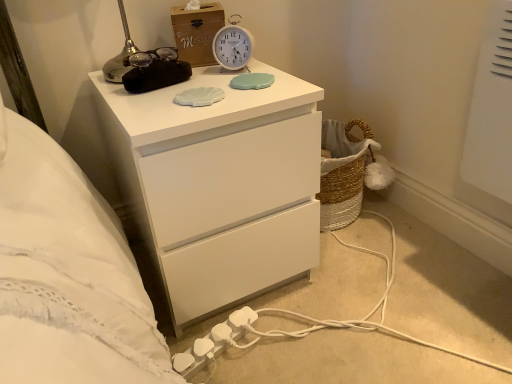
Question: Does white plastic extension cord at lower center lie in front of woodenmaterial/texturebox at upper center?

Choices:
 (A) no
 (B) yes

Answer: (B)

Question: Is white plastic extension cord at lower center next to woodenmaterial/texturebox at upper center?

Choices:
 (A) no
 (B) yes

Answer: (A)

Question: From a real-world perspective, is white plastic extension cord at lower center on woodenmaterial/texturebox at upper center?

Choices:
 (A) yes
 (B) no

Answer: (B)

Question: Considering the relative positions of white plastic extension cord at lower center and woodenmaterial/texturebox at upper center in the image provided, is white plastic extension cord at lower center to the right of woodenmaterial/texturebox at upper center from the viewer's perspective?

Choices:
 (A) no
 (B) yes

Answer: (B)

Question: Is white plastic extension cord at lower center wider than woodenmaterial/texturebox at upper center?

Choices:
 (A) yes
 (B) no

Answer: (B)

Question: From the image's perspective, would you say white plastic extension cord at lower center is shown under woodenmaterial/texturebox at upper center?

Choices:
 (A) no
 (B) yes

Answer: (B)

Question: Considering the relative positions of white matte chest of drawers at upper center and white plastic extension cord at lower center in the image provided, is white matte chest of drawers at upper center to the right of white plastic extension cord at lower center from the viewer's perspective?

Choices:
 (A) yes
 (B) no

Answer: (B)

Question: Can you confirm if white matte chest of drawers at upper center is smaller than white plastic extension cord at lower center?

Choices:
 (A) yes
 (B) no

Answer: (B)

Question: Is white plastic extension cord at lower center a part of white matte chest of drawers at upper center?

Choices:
 (A) no
 (B) yes

Answer: (A)

Question: Can you confirm if white matte chest of drawers at upper center is bigger than white plastic extension cord at lower center?

Choices:
 (A) yes
 (B) no

Answer: (A)

Question: From the image's perspective, is white matte chest of drawers at upper center under white plastic extension cord at lower center?

Choices:
 (A) yes
 (B) no

Answer: (B)

Question: From a real-world perspective, is white matte chest of drawers at upper center on top of white plastic extension cord at lower center?

Choices:
 (A) yes
 (B) no

Answer: (A)

Question: Does white plastic extension cord at lower center come in front of white matte chest of drawers at upper center?

Choices:
 (A) yes
 (B) no

Answer: (B)